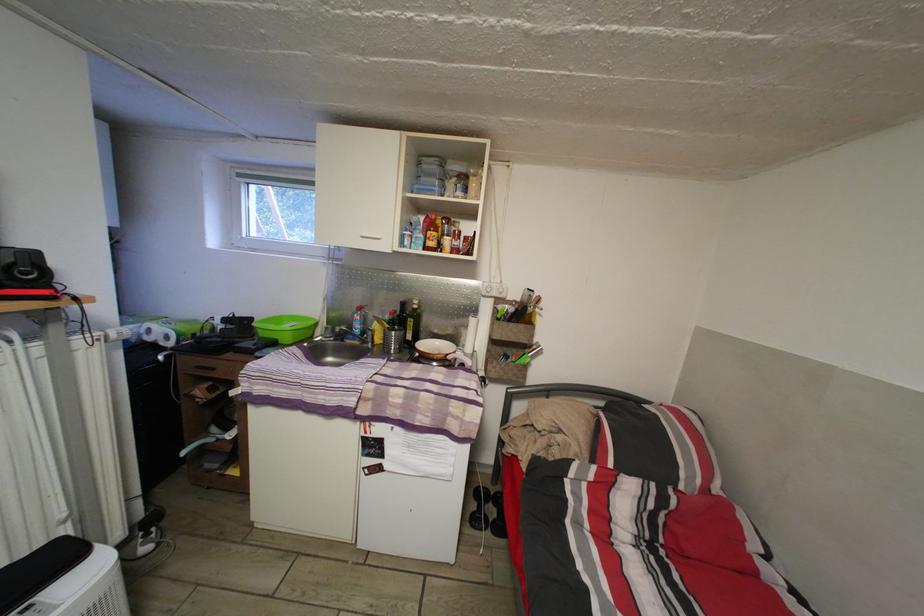
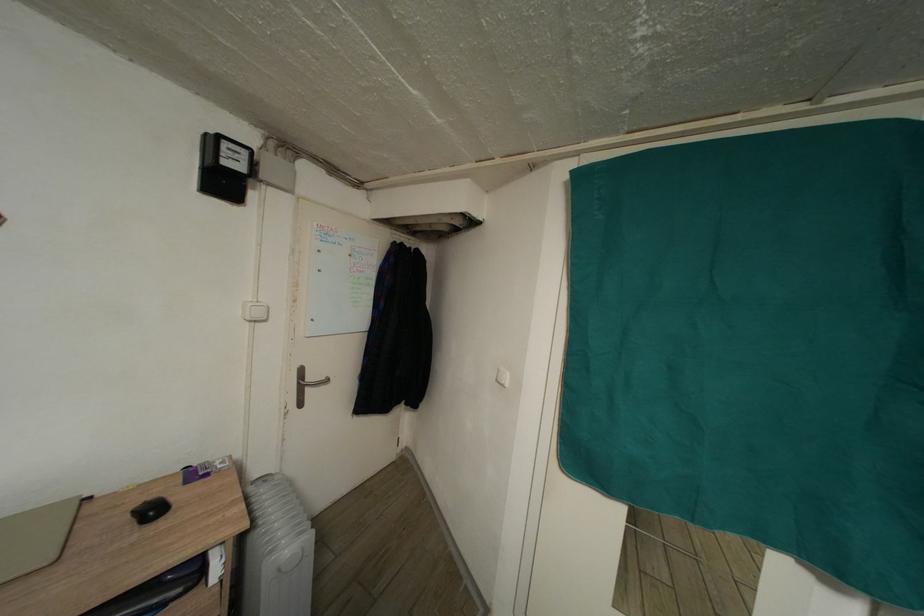
Question: The images are taken continuously from a first-person perspective. In which direction is your viewpoint rotating?

Choices:
 (A) Left
 (B) Right
 (C) Up
 (D) Down

Answer: (A)